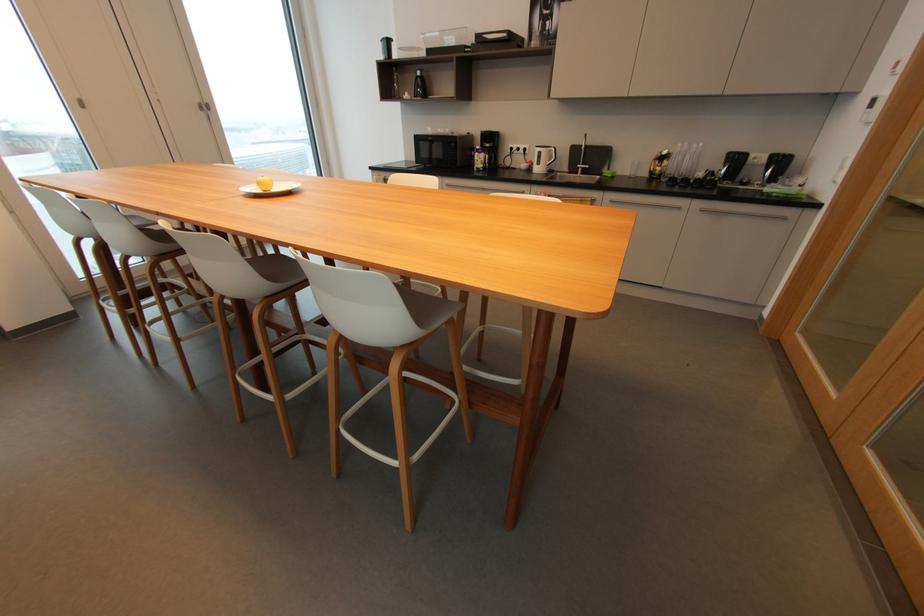
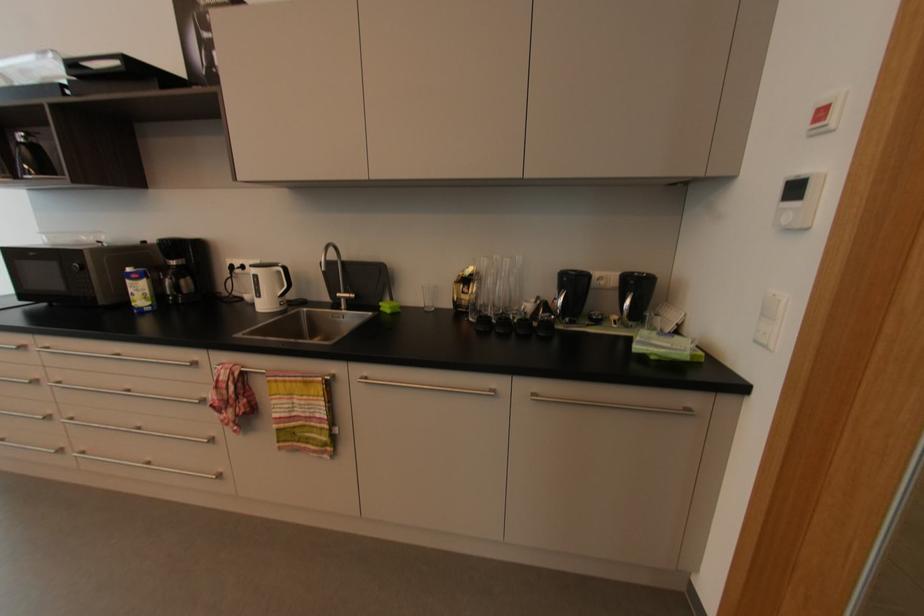
Locate, in the second image, the point that corresponds to [663,167] in the first image.

(469, 294)